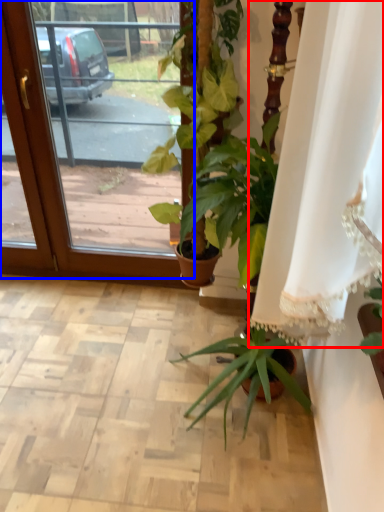
Question: Among these objects, which one is farthest to the camera, curtain (highlighted by a red box) or screen door (highlighted by a blue box)?

Choices:
 (A) curtain
 (B) screen door

Answer: (B)